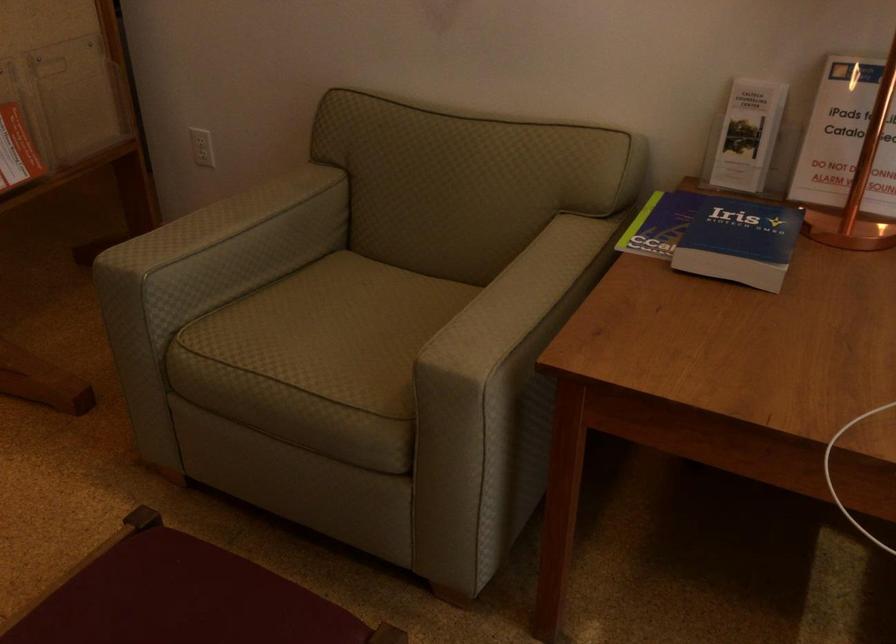
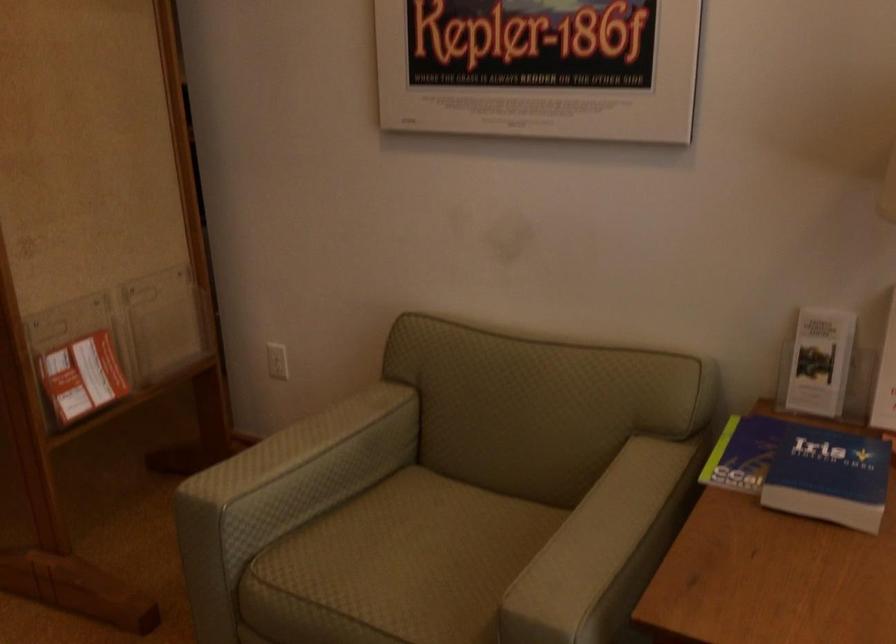
Find the pixel in the second image that matches point 209,220 in the first image.

(286, 449)